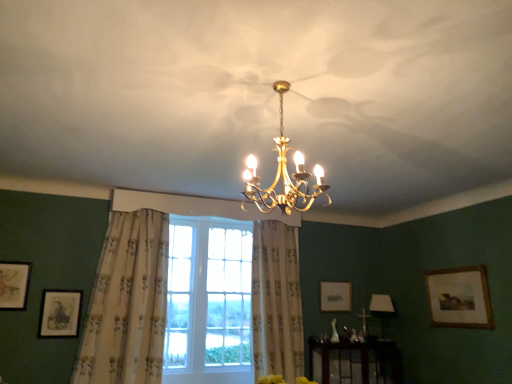
Question: From their relative heights in the image, would you say clear glass window at center is taller or shorter than gold metallic chandelier at center, acting as the second lamp starting from the bottom?

Choices:
 (A) short
 (B) tall

Answer: (B)

Question: From the image's perspective, is clear glass window at center above or below gold metallic chandelier at center, the 1th lamp from the front?

Choices:
 (A) below
 (B) above

Answer: (A)

Question: Considering the real-world distances, which object is farthest from the matte gold picture frame at left, the 1th picture frame when ordered from left to right?

Choices:
 (A) white floral fabric curtain at left, arranged as the 1th curtain when viewed from the left
 (B) matte silver picture frame at center-right, the first picture frame positioned from the back
 (C) gold metallic chandelier at center, which is the 1th lamp from top to bottom
 (D) beige floral fabric curtain at center, the 2th curtain positioned from the left
 (E) wooden framed painting at right, which is the 4th picture frame from left to right

Answer: (E)

Question: Which object is the closest to the matte gold picture frame at lower left, the 2th picture frame positioned from the left?

Choices:
 (A) matte white lampshade at lower right, which is the first lamp from right to left
 (B) beige floral fabric curtain at center, the 2th curtain positioned from the left
 (C) matte silver picture frame at center-right, the second picture frame when ordered from right to left
 (D) clear glass window at center
 (E) matte gold picture frame at left, the 1th picture frame when ordered from left to right

Answer: (E)